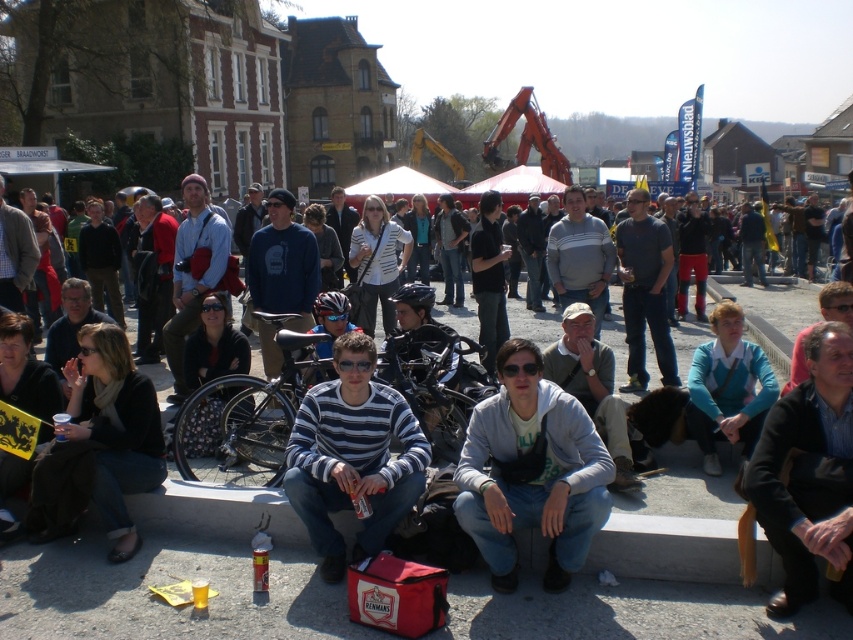
You are standing in the town square and see a black leather jacket at lower right. Where exactly is it located in the image coordinates?

The black leather jacket at lower right is located at point coordinates of (808, 474).

You are a photographer positioned at the center of the town square. You want to take a photo that includes both the black leather jacket at lower right and the striped cotton shirt at center. Based on their positions, which object should you adjust your camera to focus on first to ensure both are in frame?

Since the black leather jacket at lower right is to the right of the striped cotton shirt at center, you should first focus on the striped cotton shirt at center to ensure both are within the frame.